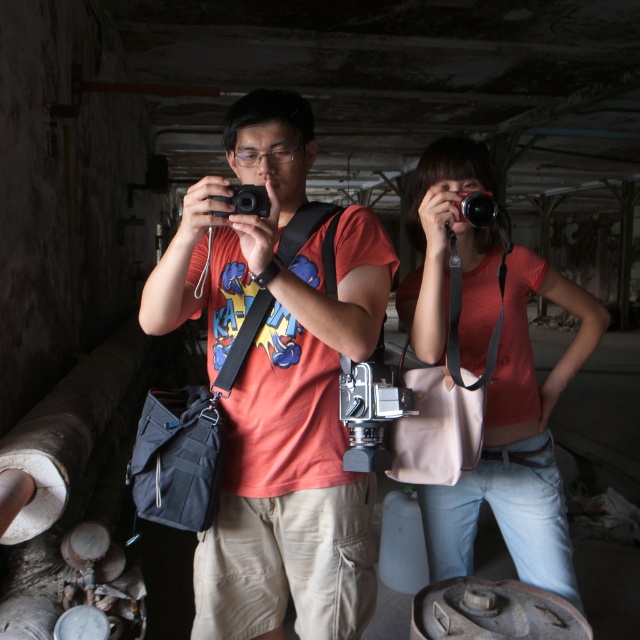
Question: Does matte pink purse at center lie in front of black plastic camera at center?

Choices:
 (A) no
 (B) yes

Answer: (A)

Question: Estimate the real-world distances between objects in this image. Which object is closer to the matte pink purse at center?

Choices:
 (A) black plastic camera at center
 (B) black plastic camera at upper center

Answer: (B)

Question: Which point is farther to the camera?

Choices:
 (A) black plastic camera at upper center
 (B) matte pink purse at center
 (C) matte black camera at center
 (D) black plastic camera at center

Answer: (B)

Question: Does matte black camera at center have a larger size compared to matte pink purse at center?

Choices:
 (A) no
 (B) yes

Answer: (A)

Question: Which is farther from the black plastic camera at upper center?

Choices:
 (A) black plastic camera at center
 (B) matte pink purse at center
 (C) matte black camera at center

Answer: (A)

Question: Is matte black camera at center thinner than matte pink purse at center?

Choices:
 (A) no
 (B) yes

Answer: (B)